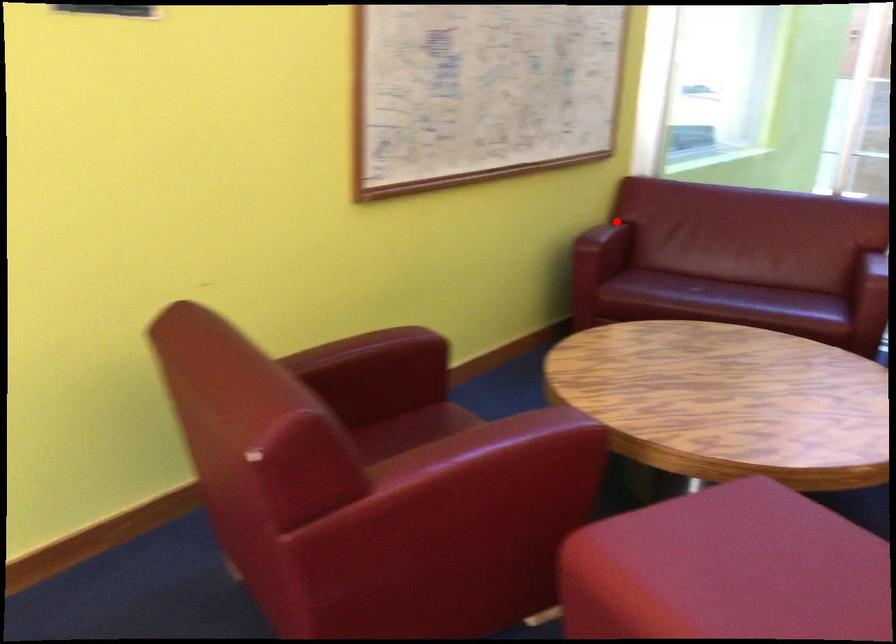
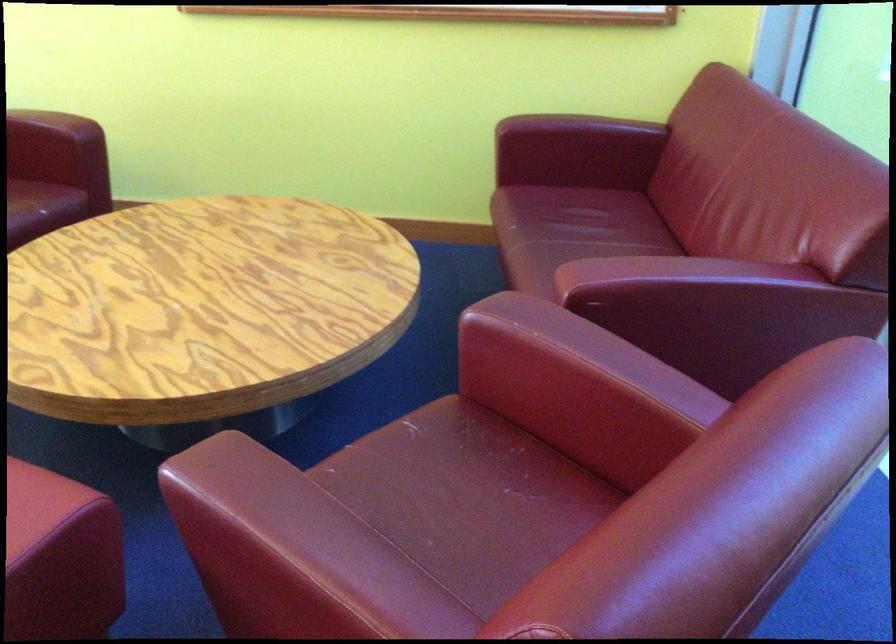
Question: I am providing you with two images of the same scene from different viewpoints. A red point is shown in image1. For the corresponding object point in image2, is it positioned nearer or farther from the camera?

Choices:
 (A) Nearer
 (B) Farther

Answer: (A)